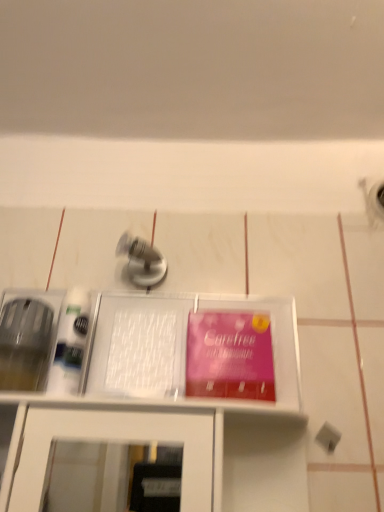
Locate an element on the screen. This screenshot has height=512, width=384. empty space that is ontop of white plastic tray at center is located at coordinates (160, 291).